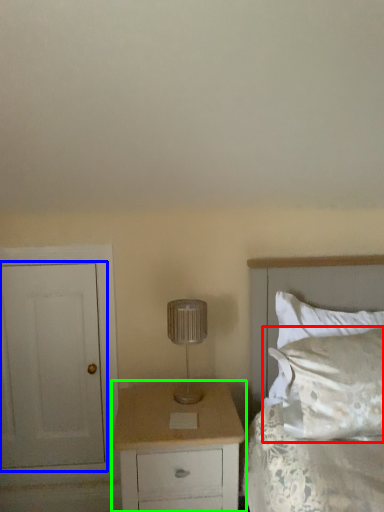
Question: Which object is the closest to the pillow (highlighted by a red box)? Choose among these: door (highlighted by a blue box) or chest of drawers (highlighted by a green box).

Choices:
 (A) door
 (B) chest of drawers

Answer: (B)